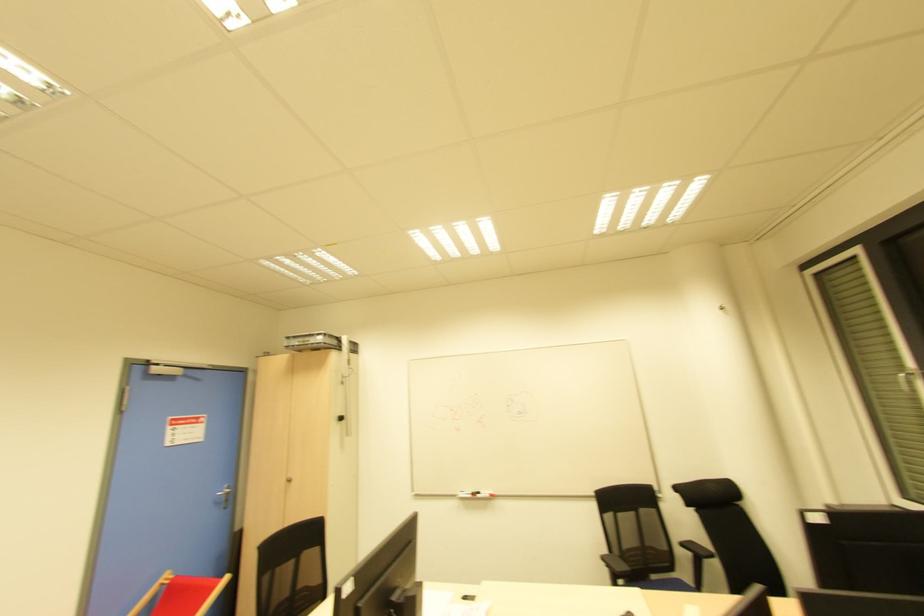
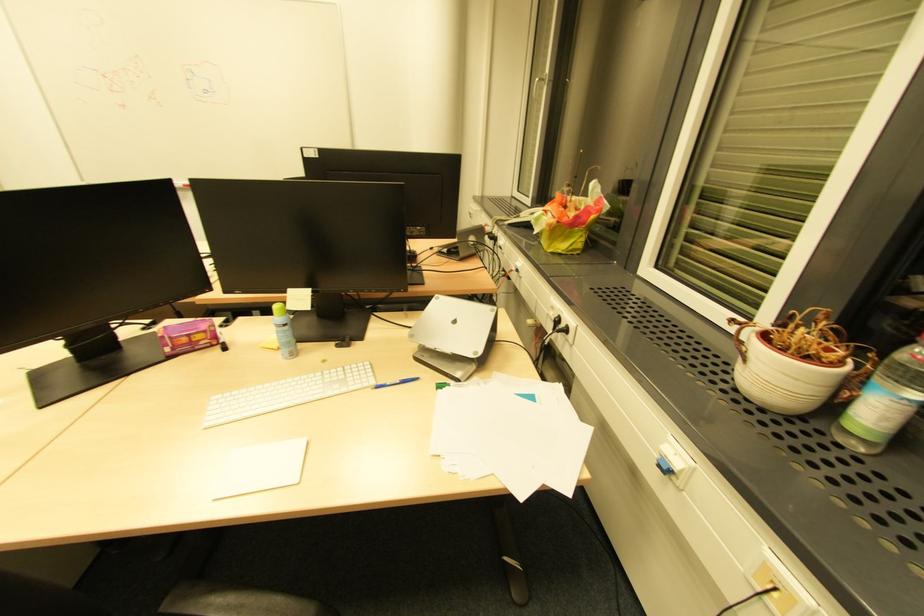
Question: I am providing you with two images of the same scene from different viewpoints. After the viewpoint changes to image2, which objects are now occluded?

Choices:
 (A) red patterned glass
 (B) black whiteboard marker
 (C) blue pen
 (D) white plant pot

Answer: (B)